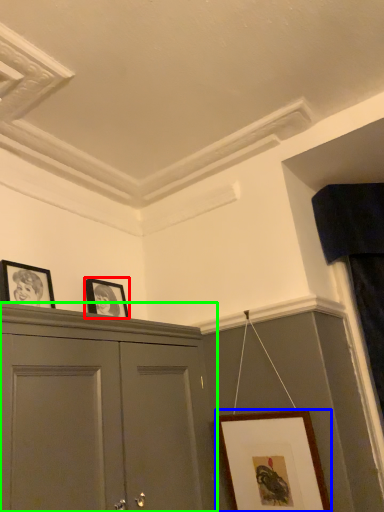
Question: Based on their relative distances, which object is nearer to picture frame (highlighted by a red box)? Choose from picture frame (highlighted by a blue box) and cabinetry (highlighted by a green box).

Choices:
 (A) picture frame
 (B) cabinetry

Answer: (B)